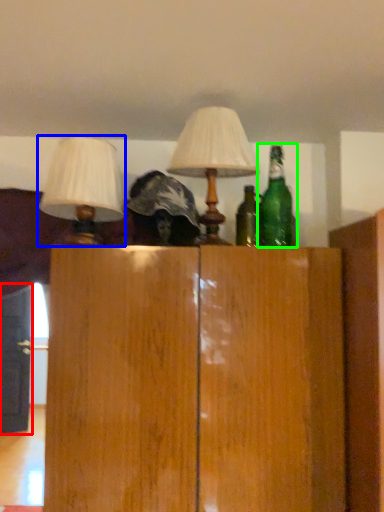
Question: Estimate the real-world distances between objects in this image. Which object is closer to door (highlighted by a red box), lamp (highlighted by a blue box) or bottle (highlighted by a green box)?

Choices:
 (A) lamp
 (B) bottle

Answer: (A)